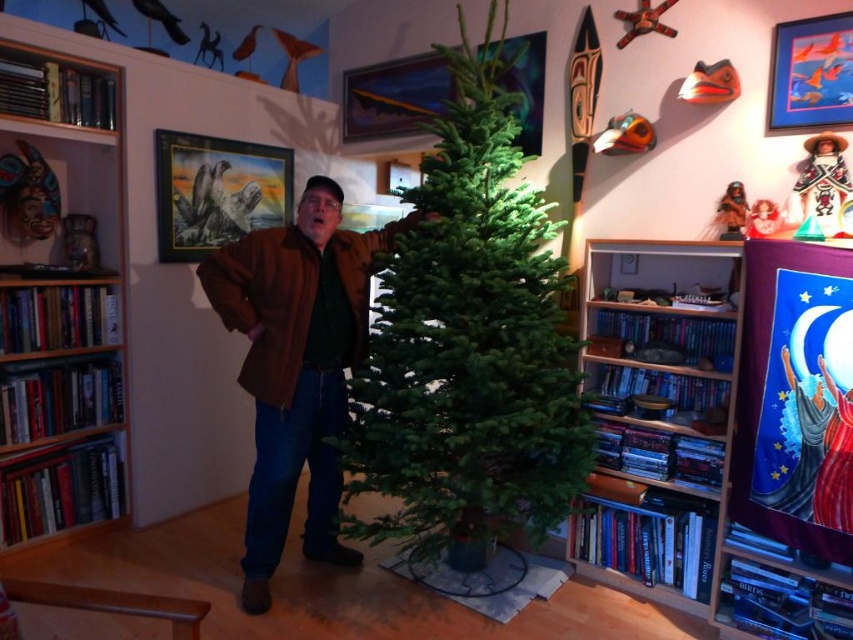
Between green matte christmas tree at center and wooden bookshelf at left, which one is positioned higher?

green matte christmas tree at center is higher up.

Is point (419, 458) farther from camera compared to point (61, 500)?

No.

Identify the location of green matte christmas tree at center. Image resolution: width=853 pixels, height=640 pixels. (469, 344).

This screenshot has height=640, width=853. Find the location of `wooden bookshelf at right`. wooden bookshelf at right is located at coordinates (657, 413).

How distant is wooden bookshelf at right from brown leather jacket at center?

wooden bookshelf at right and brown leather jacket at center are 1.11 meters apart.

Locate an element on the screen. wooden bookshelf at right is located at coordinates (657, 413).

The width and height of the screenshot is (853, 640). In order to click on wooden bookshelf at right in this screenshot , I will do `click(657, 413)`.

The height and width of the screenshot is (640, 853). What do you see at coordinates (62, 301) in the screenshot? I see `wooden bookshelf at left` at bounding box center [62, 301].

Does wooden bookshelf at left appear under wooden bookshelf at right?

No.

Describe the element at coordinates (62, 301) in the screenshot. Image resolution: width=853 pixels, height=640 pixels. I see `wooden bookshelf at left` at that location.

The height and width of the screenshot is (640, 853). What are the coordinates of `wooden bookshelf at left` in the screenshot? It's located at (62, 301).